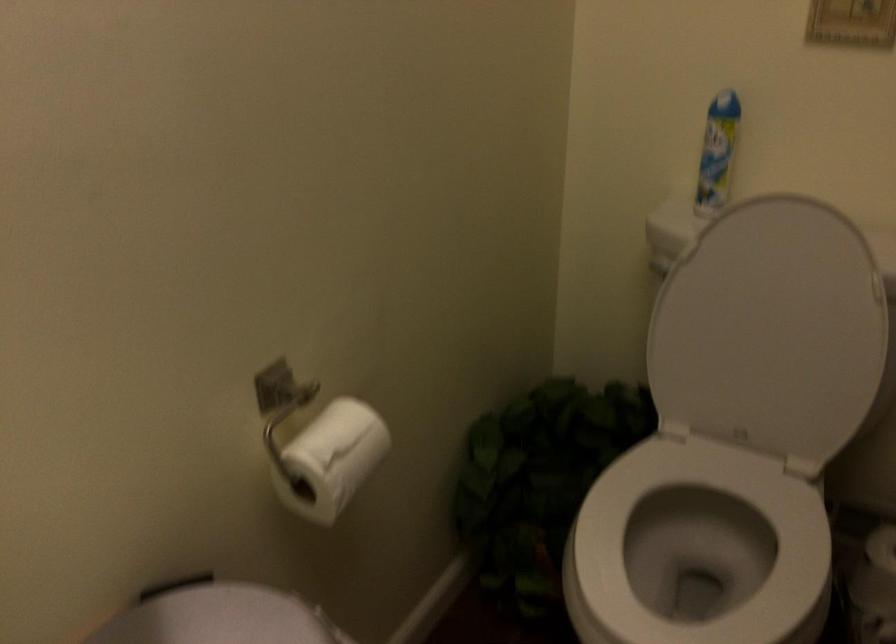
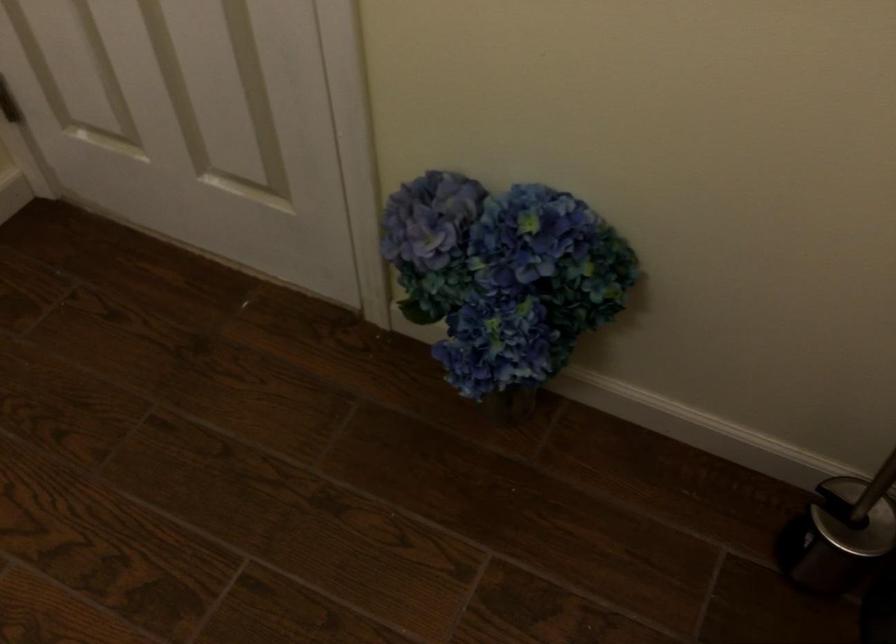
First-person continuous shooting, in which direction is the camera rotating?

The camera rotated toward left-down.